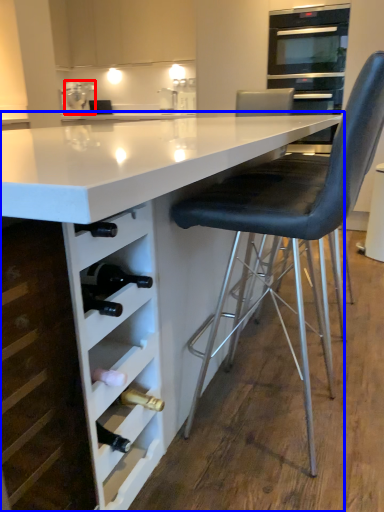
Question: Among these objects, which one is nearest to the camera, kitchen appliance (highlighted by a red box) or table (highlighted by a blue box)?

Choices:
 (A) kitchen appliance
 (B) table

Answer: (B)